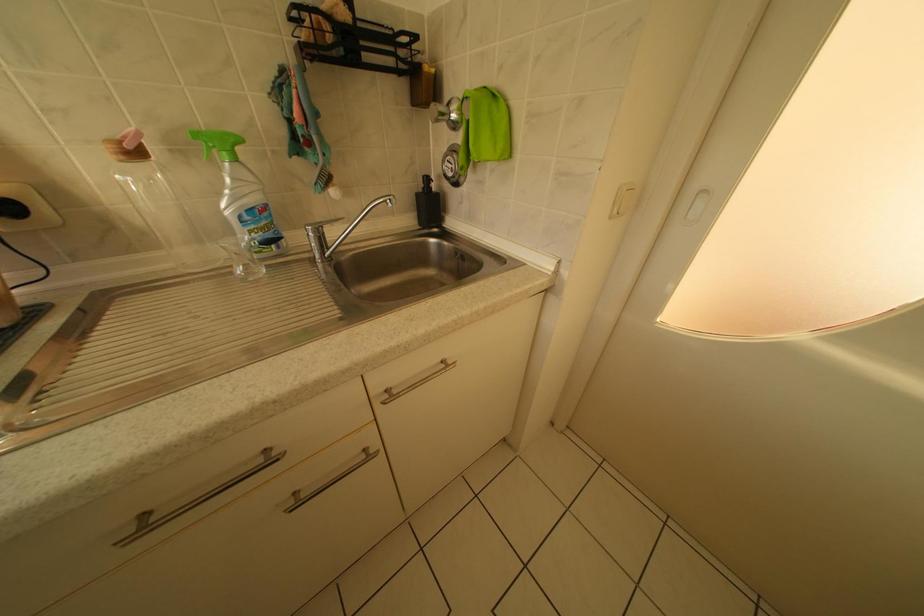
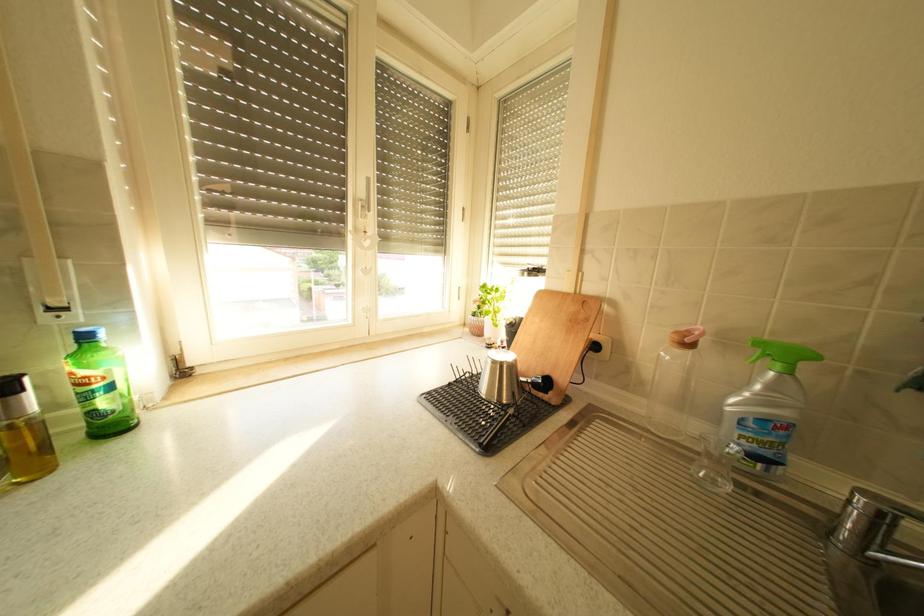
Question: Based on the continuous images, in which direction is the camera rotating? Reply with the corresponding letter.

Choices:
 (A) Left
 (B) Right
 (C) Up
 (D) Down

Answer: (A)